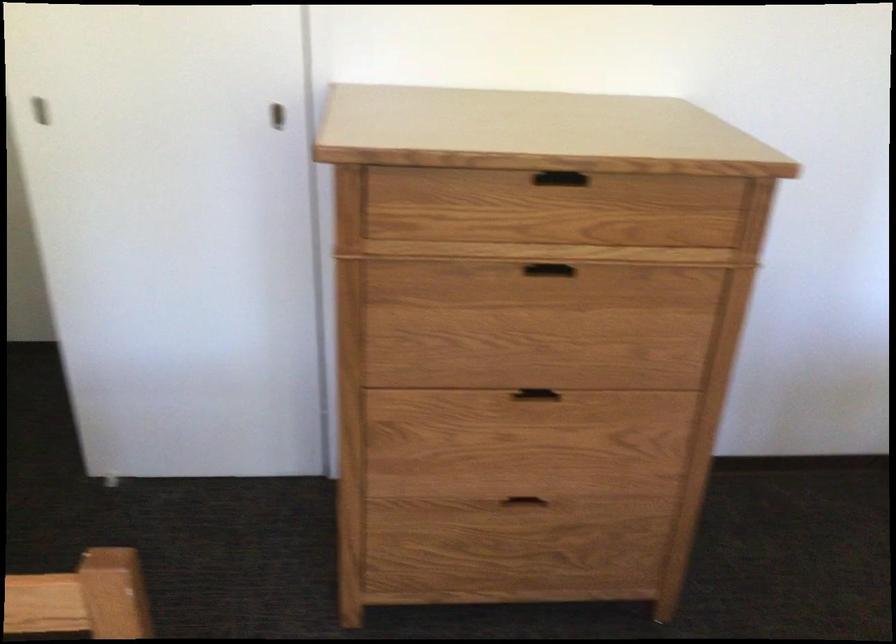
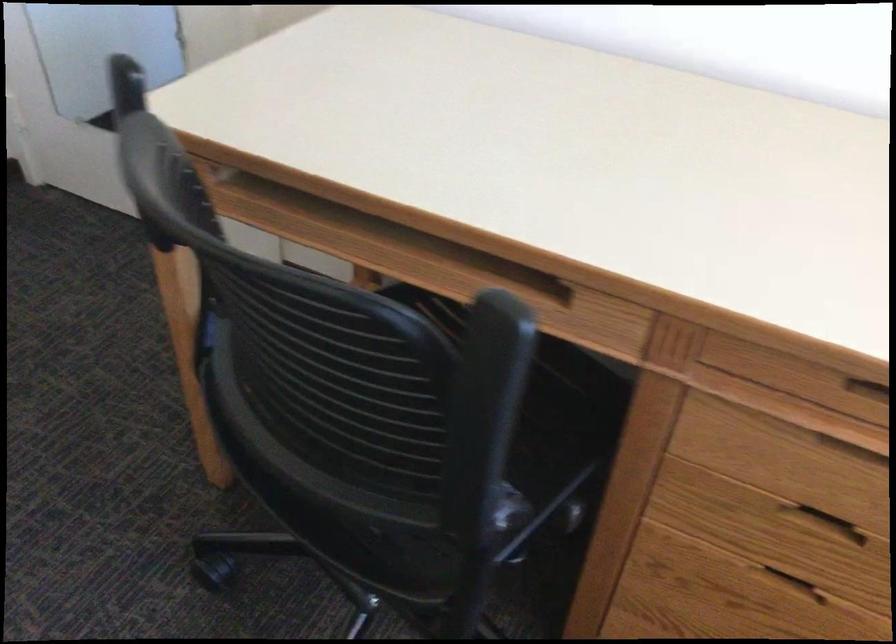
The first image is from the beginning of the video and the second image is from the end. How did the camera likely rotate when shooting the video?

The camera's rotation is toward right-down.